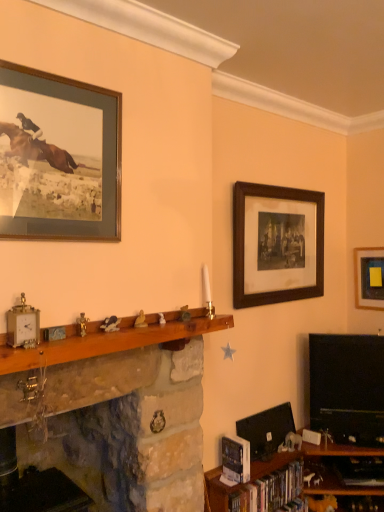
Where is `vacant area on top of wooden framed print at upper right, which ranks as the second picture frame in right-to-left order (from a real-world perspective)`? The width and height of the screenshot is (384, 512). vacant area on top of wooden framed print at upper right, which ranks as the second picture frame in right-to-left order (from a real-world perspective) is located at coordinates (284, 186).